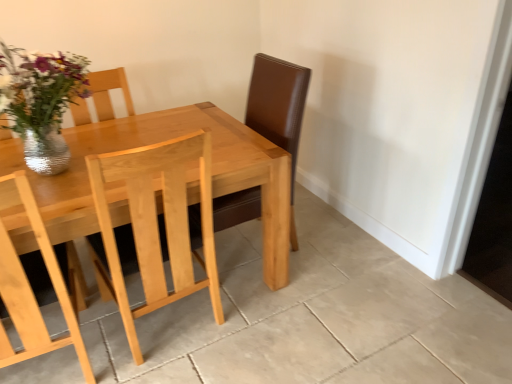
Question: Is point (57, 100) positioned closer to the camera than point (189, 258)?

Choices:
 (A) farther
 (B) closer

Answer: (B)

Question: Do you think metallic silver vase at upper left is within light wood chair at center, or outside of it?

Choices:
 (A) outside
 (B) inside

Answer: (A)

Question: Estimate the real-world distances between objects in this image. Which object is closer to the light wood table at center?

Choices:
 (A) metallic silver vase at upper left
 (B) light wood chair at center

Answer: (B)

Question: Considering the real-world distances, which object is farthest from the metallic silver vase at upper left?

Choices:
 (A) light wood chair at center
 (B) light wood table at center

Answer: (A)